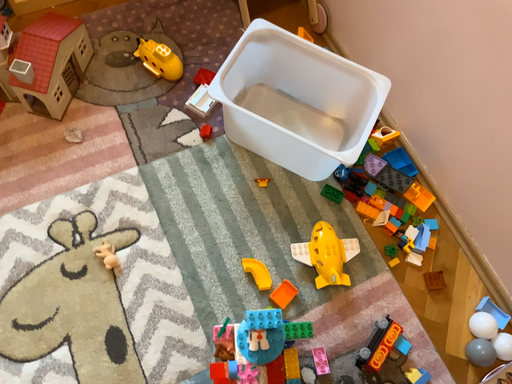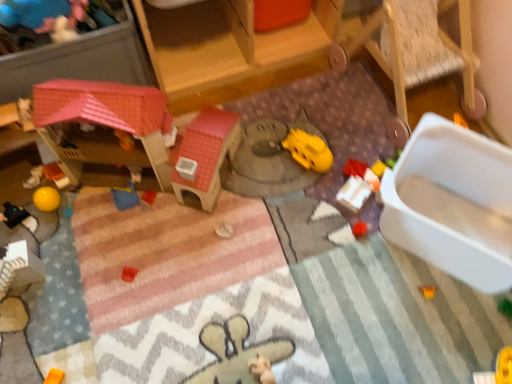
Question: How did the camera likely rotate when shooting the video?

Choices:
 (A) rotated downward
 (B) rotated upward

Answer: (B)